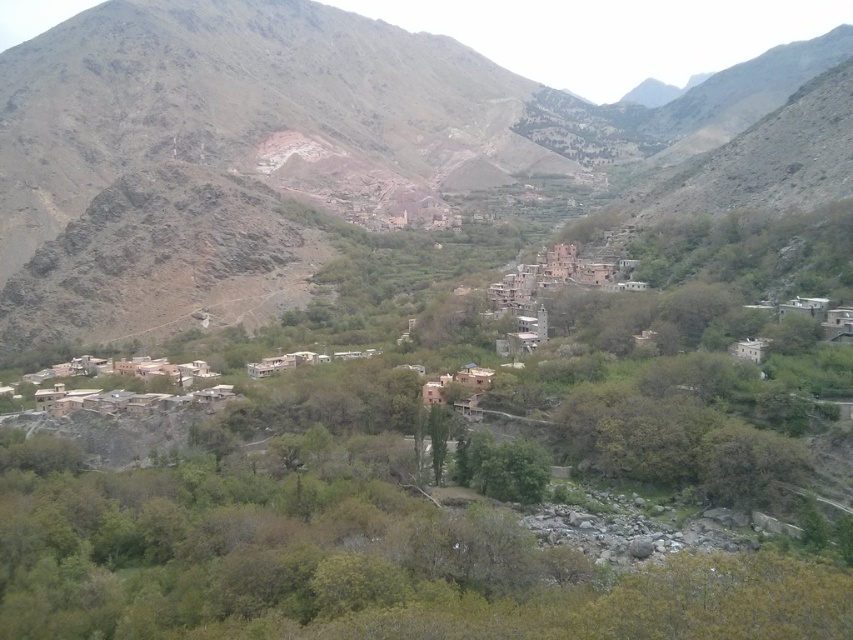
Question: Among these objects, which one is farthest from the camera?

Choices:
 (A) green leafy tree at center
 (B) brown rocky mountain at center

Answer: (B)

Question: Which point is closer to the camera taking this photo?

Choices:
 (A) (41, 84)
 (B) (276, 582)

Answer: (B)

Question: Does brown rocky mountain at center appear on the right side of green leafy tree at center?

Choices:
 (A) no
 (B) yes

Answer: (B)

Question: Which object is closer to the camera taking this photo?

Choices:
 (A) green leafy tree at center
 (B) brown rocky mountain at center

Answer: (A)

Question: Is brown rocky mountain at center closer to camera compared to green leafy tree at center?

Choices:
 (A) no
 (B) yes

Answer: (A)

Question: Is brown rocky mountain at center smaller than green leafy tree at center?

Choices:
 (A) yes
 (B) no

Answer: (B)